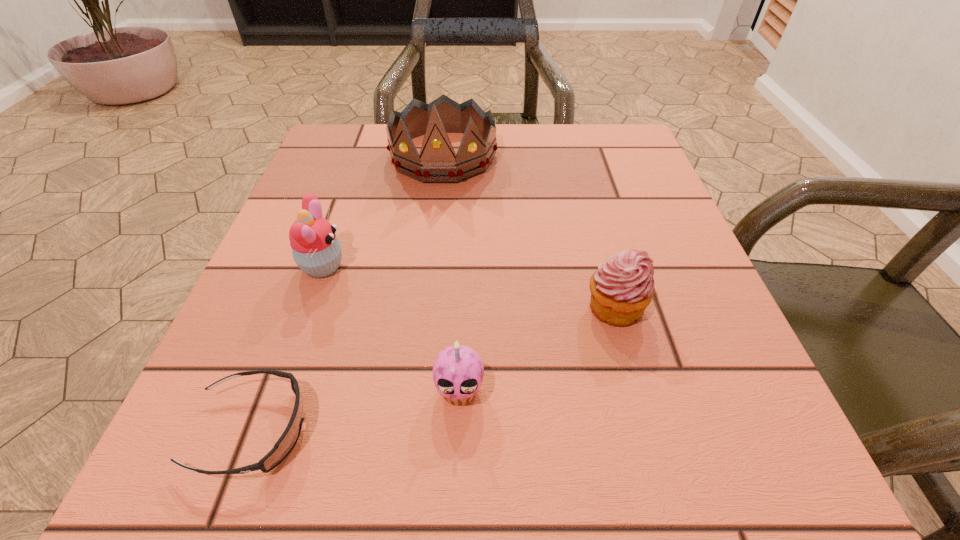
This screenshot has width=960, height=540. Find the location of `free location that satisfies the following two spatial constraints: 1. on the face of the nearest cupcake; 2. on the lenses of the shortest object`. free location that satisfies the following two spatial constraints: 1. on the face of the nearest cupcake; 2. on the lenses of the shortest object is located at coordinates (458, 430).